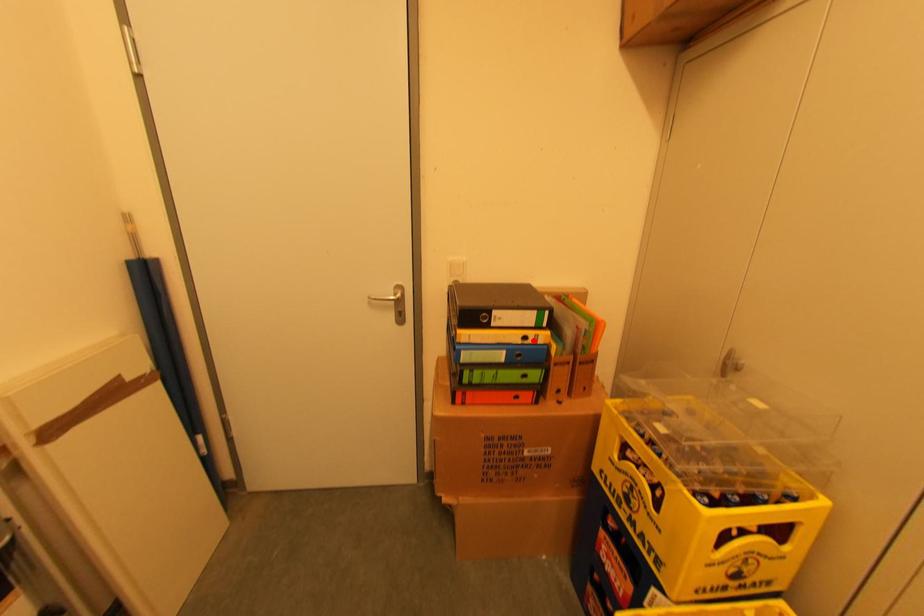
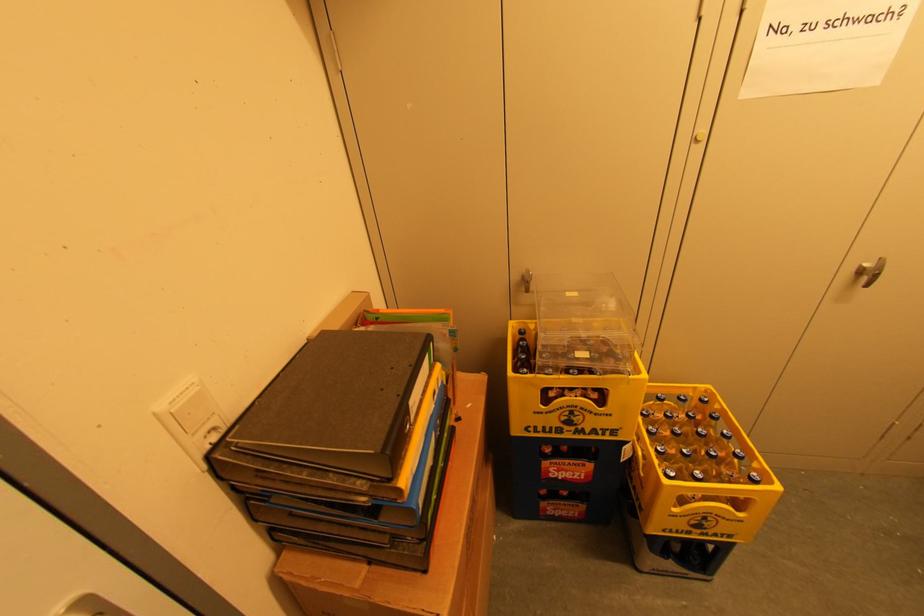
Find the pixel in the second image that matches the highlighted location in the first image.

(440, 392)